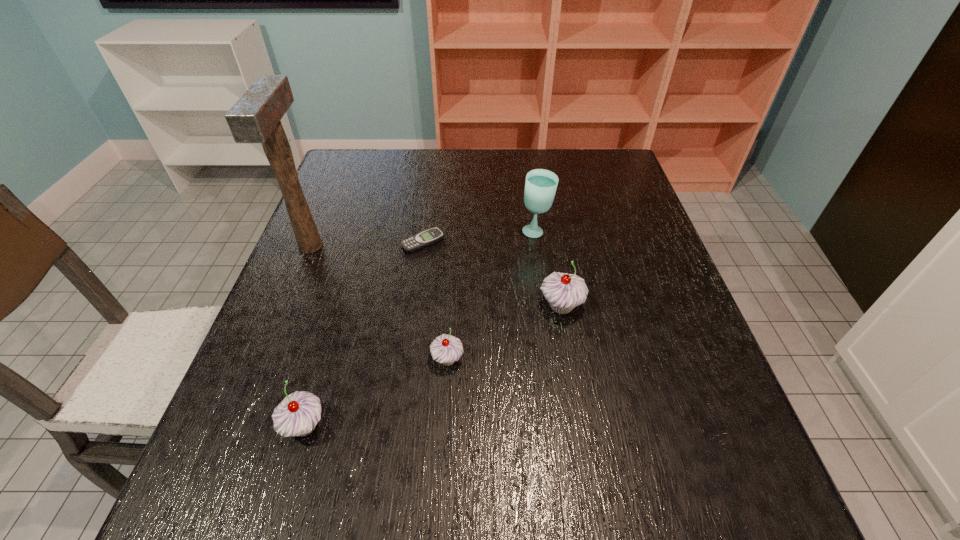
Image resolution: width=960 pixels, height=540 pixels. I want to click on free region that satisfies the following two spatial constraints: 1. on the back side of the second tallest cupcake; 2. on the left side of the beeper, so click(x=359, y=242).